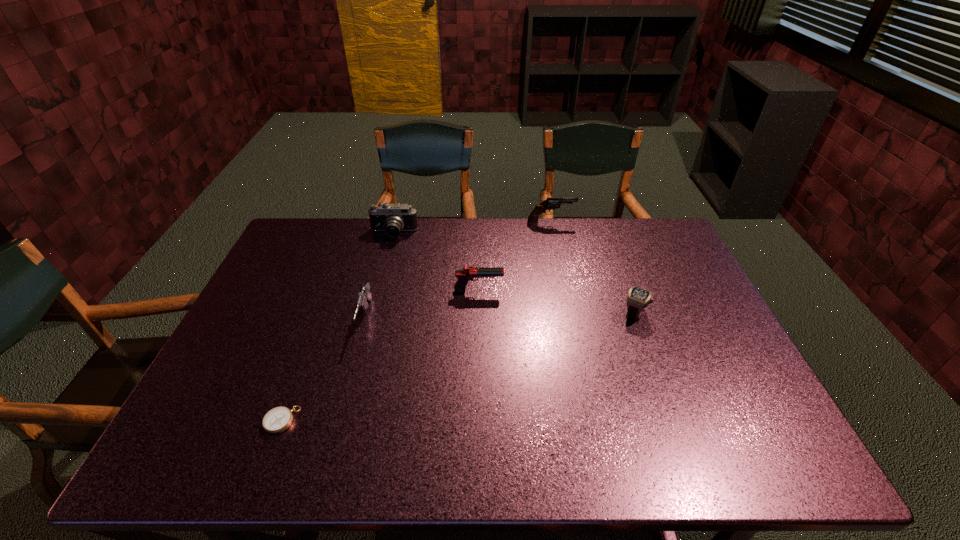
Identify the location of the fifth object from left to right. [550, 203].

Locate an element on the screen. Image resolution: width=960 pixels, height=540 pixels. the farthest object is located at coordinates (550, 203).

Identify the location of camera. (392, 218).

The image size is (960, 540). Find the location of `the second farthest gun`. the second farthest gun is located at coordinates (467, 273).

At what (x,y) coordinates should I click in order to perform the action: click on the third farthest object. Please return your answer as a coordinate pair (x, y). The image size is (960, 540). Looking at the image, I should click on (467, 273).

Locate an element on the screen. The height and width of the screenshot is (540, 960). the leftmost gun is located at coordinates (364, 294).

Where is `watch`? watch is located at coordinates click(x=637, y=299).

You are a GUI agent. You are given a task and a screenshot of the screen. Output one action in this format:
    pyautogui.click(x=<x>, y=<y>)
    Task: Click on the nearest object
    The width and height of the screenshot is (960, 540).
    Given the screenshot: What is the action you would take?
    pyautogui.click(x=278, y=419)

The width and height of the screenshot is (960, 540). Identify the location of the shortest object. (278, 419).

This screenshot has height=540, width=960. I want to click on vacant space located along the barrel of the fifth object from left to right, so click(x=594, y=223).